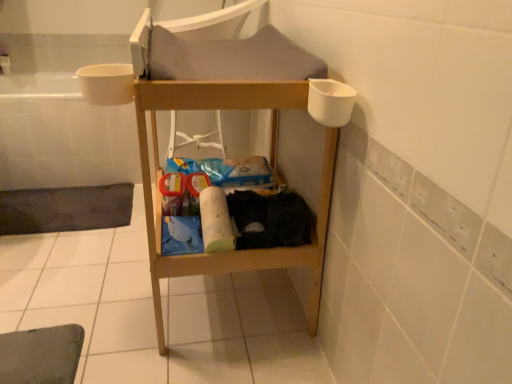
Question: Does point (39, 190) appear closer or farther from the camera than point (101, 147)?

Choices:
 (A) closer
 (B) farther

Answer: (A)

Question: Is dark gray mesh bath mat at lower left in front of or behind white plastic bath at left in the image?

Choices:
 (A) behind
 (B) front

Answer: (B)

Question: Which object is the farthest from the white plastic bath at left?

Choices:
 (A) white matte toilet paper at center
 (B) dark gray mesh bath mat at lower left

Answer: (A)

Question: Based on their relative distances, which object is farther from the dark gray mesh bath mat at lower left?

Choices:
 (A) white plastic bath at left
 (B) white matte toilet paper at center

Answer: (B)